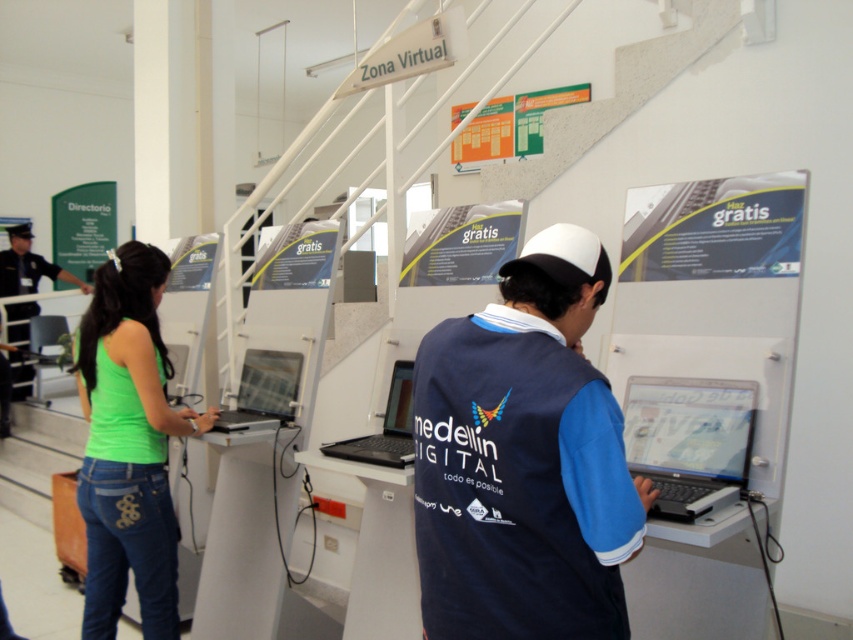
You are standing in the room and want to determine which of the two points, point (751, 388) or point (24, 304), is closer to you. Based on the scene description, which point is nearer?

Point (751, 388) is closer to the camera than point (24, 304), so it is the nearer point.

Based on the photo, you are navigating through a public computer area and need to locate two specific points marked in the scene. Which of the two points, point 1 at coordinates (463, 632) or point 2 at (408, 365), is closer to you as you stand in the center of the room?

Point 1 at coordinates (463, 632) is closer to the viewer than point 2 at (408, 365).